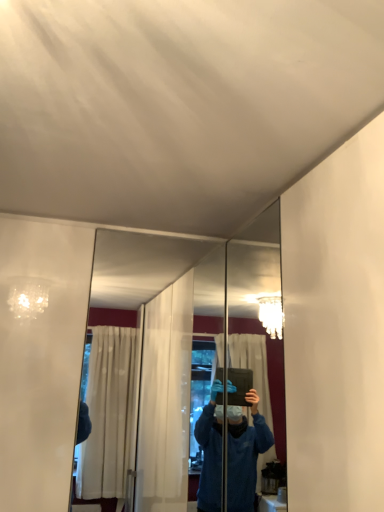
Question: Does polished silver mirror at center, acting as the first mirror starting from the right, appear on the left side of clear glass mirror at center, the 2th mirror when ordered from right to left?

Choices:
 (A) yes
 (B) no

Answer: (B)

Question: From a real-world perspective, does polished silver mirror at center, acting as the first mirror starting from the right, stand above clear glass mirror at center, the 1th mirror when ordered from left to right?

Choices:
 (A) no
 (B) yes

Answer: (A)

Question: Does polished silver mirror at center, acting as the first mirror starting from the right, lie in front of clear glass mirror at center, the 1th mirror when ordered from left to right?

Choices:
 (A) yes
 (B) no

Answer: (A)

Question: Does polished silver mirror at center, acting as the first mirror starting from the right, come behind clear glass mirror at center, the 1th mirror when ordered from left to right?

Choices:
 (A) no
 (B) yes

Answer: (A)

Question: Considering the relative sizes of polished silver mirror at center, acting as the first mirror starting from the right, and clear glass mirror at center, the 1th mirror when ordered from left to right, in the image provided, is polished silver mirror at center, acting as the first mirror starting from the right, taller than clear glass mirror at center, the 1th mirror when ordered from left to right,?

Choices:
 (A) no
 (B) yes

Answer: (A)

Question: Is polished silver mirror at center, acting as the first mirror starting from the right, to the right of clear glass mirror at center, the 1th mirror when ordered from left to right, from the viewer's perspective?

Choices:
 (A) yes
 (B) no

Answer: (A)

Question: Is clear glass mirror at center, the 1th mirror when ordered from left to right, positioned with its back to polished silver mirror at center, acting as the first mirror starting from the right?

Choices:
 (A) no
 (B) yes

Answer: (A)

Question: Is clear glass mirror at center, the 1th mirror when ordered from left to right, taller than polished silver mirror at center, acting as the first mirror starting from the right?

Choices:
 (A) yes
 (B) no

Answer: (A)

Question: From a real-world perspective, is clear glass mirror at center, the 1th mirror when ordered from left to right, located beneath polished silver mirror at center, the second mirror viewed from the left?

Choices:
 (A) no
 (B) yes

Answer: (A)

Question: Is clear glass mirror at center, the 2th mirror when ordered from right to left, shorter than polished silver mirror at center, acting as the first mirror starting from the right?

Choices:
 (A) yes
 (B) no

Answer: (B)

Question: Can you confirm if clear glass mirror at center, the 1th mirror when ordered from left to right, is positioned to the right of polished silver mirror at center, acting as the first mirror starting from the right?

Choices:
 (A) no
 (B) yes

Answer: (A)

Question: Is clear glass mirror at center, the 1th mirror when ordered from left to right, further to the viewer compared to polished silver mirror at center, acting as the first mirror starting from the right?

Choices:
 (A) yes
 (B) no

Answer: (A)

Question: In terms of height, does clear glass mirror at center, the 2th mirror when ordered from right to left, look taller or shorter compared to polished silver mirror at center, acting as the first mirror starting from the right?

Choices:
 (A) short
 (B) tall

Answer: (B)